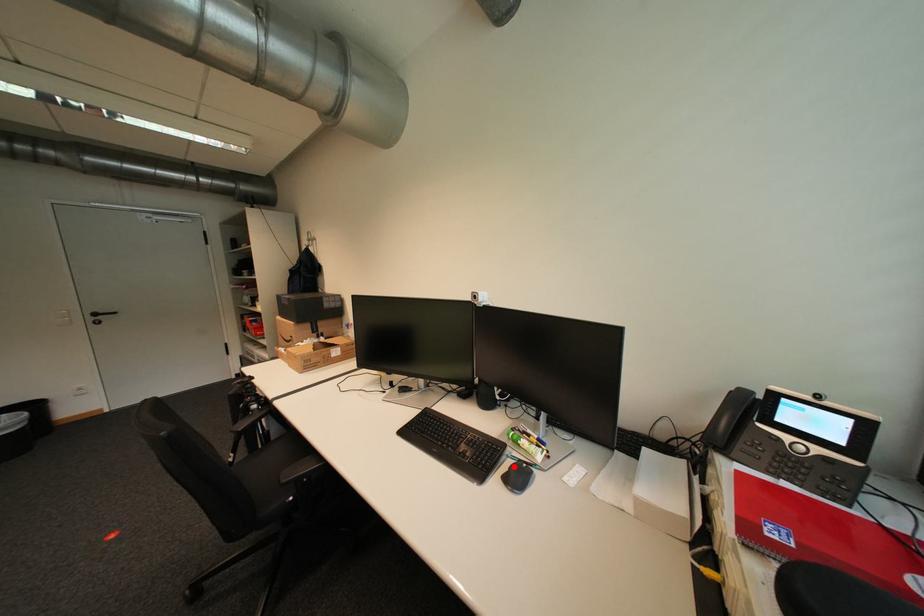
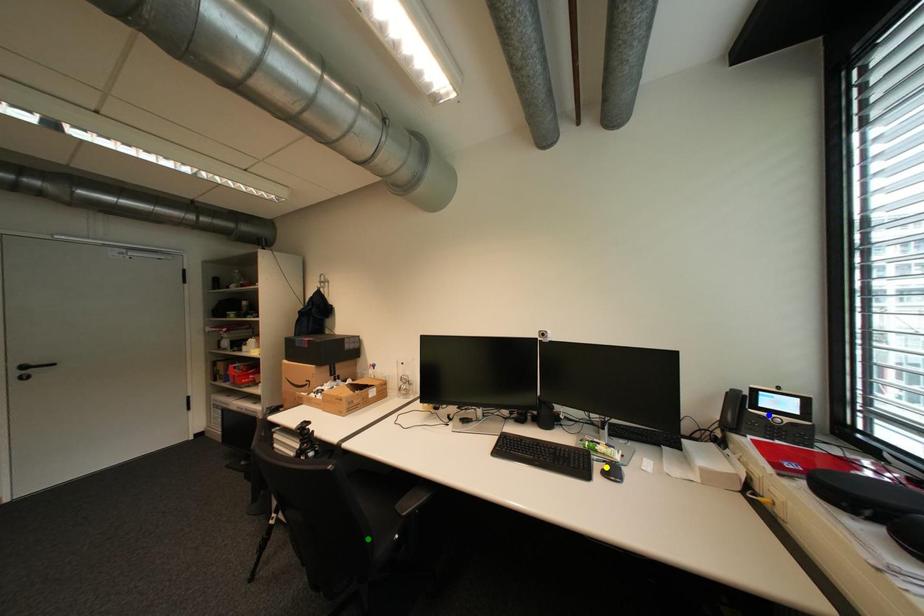
Question: I am providing you with two images of the same scene from different viewpoints. A red point is marked on the first image. You are given multiple points on the second image. Which mark in image 2 goes with the point in image 1?

Choices:
 (A) blue point
 (B) green point
 (C) yellow point

Answer: (C)